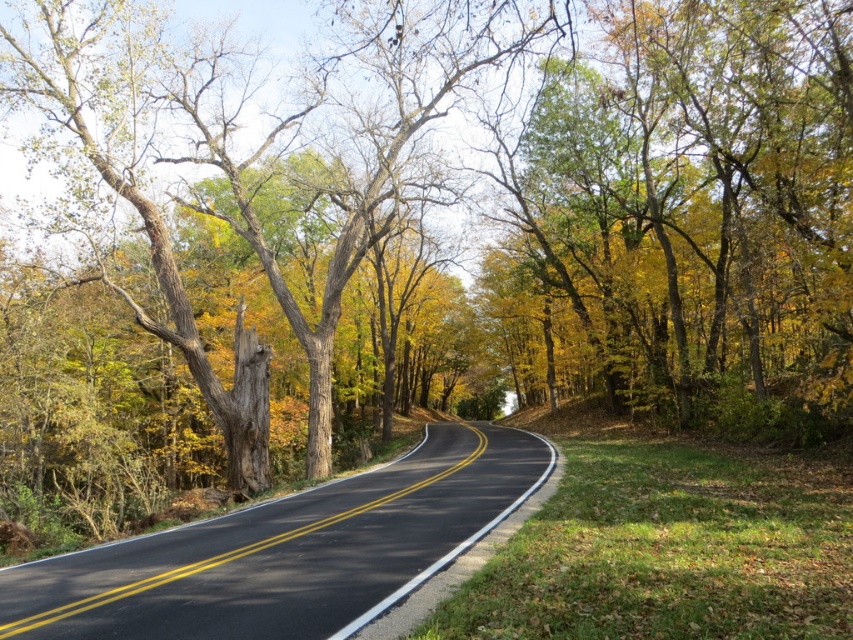
Can you confirm if green leafy tree at upper right is thinner than black asphalt highway at center?

No, green leafy tree at upper right is not thinner than black asphalt highway at center.

Is green leafy tree at upper right wider than black asphalt highway at center?

Correct, the width of green leafy tree at upper right exceeds that of black asphalt highway at center.

Who is more forward, (642, 305) or (15, 616)?

Point (15, 616) is in front.

Locate an element on the screen. green leafy tree at upper right is located at coordinates (701, 209).

Who is more forward, (401, 3) or (317, 605)?

Positioned in front is point (317, 605).

Is smooth bark tree at center to the left of black asphalt highway at center from the viewer's perspective?

Indeed, smooth bark tree at center is positioned on the left side of black asphalt highway at center.

Who is more forward, (x=189, y=333) or (x=271, y=628)?

Point (x=271, y=628) is in front.

The width and height of the screenshot is (853, 640). Identify the location of smooth bark tree at center. (256, 154).

Is point (537, 180) less distant than point (242, 429)?

No, (537, 180) is further to viewer.

Which is more to the left, green leafy tree at upper right or smooth bark tree at center?

smooth bark tree at center is more to the left.

Which is behind, point (753, 84) or point (412, 88)?

Point (412, 88)

The image size is (853, 640). What are the coordinates of `green leafy tree at upper right` in the screenshot? It's located at (701, 209).